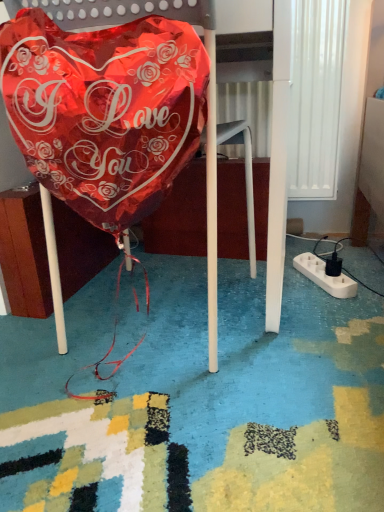
Question: Is white plastic extension cord at lower right taller or shorter than shiny metallic balloon at center?

Choices:
 (A) tall
 (B) short

Answer: (B)

Question: Looking at the image, does white plastic extension cord at lower right seem bigger or smaller compared to shiny metallic balloon at center?

Choices:
 (A) big
 (B) small

Answer: (B)

Question: Which of these objects is positioned farthest from the shiny metallic balloon at center?

Choices:
 (A) shiny metallic balloon at left
 (B) white plastic extension cord at lower right

Answer: (B)

Question: Based on their relative distances, which object is farther from the white plastic extension cord at lower right?

Choices:
 (A) shiny metallic balloon at left
 (B) shiny metallic balloon at center

Answer: (A)